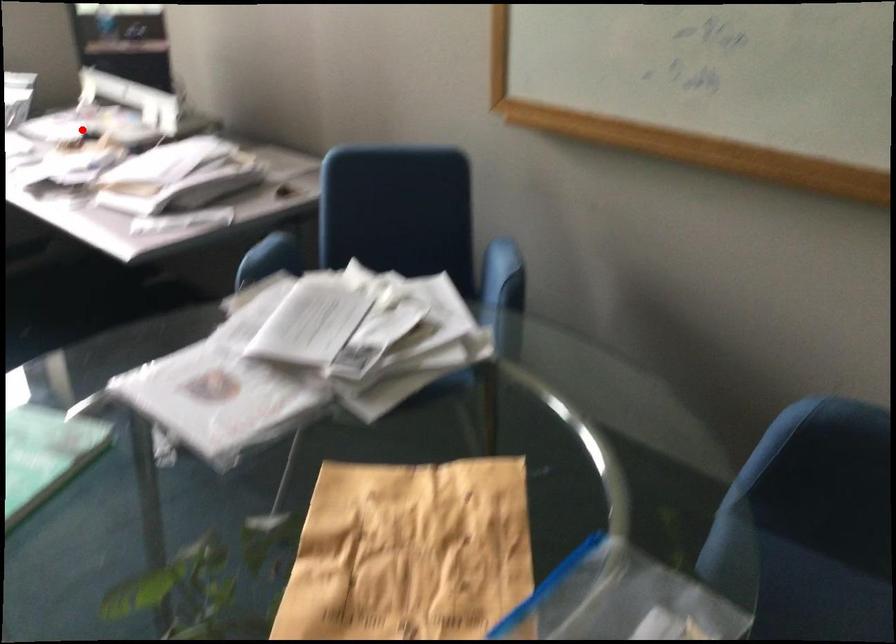
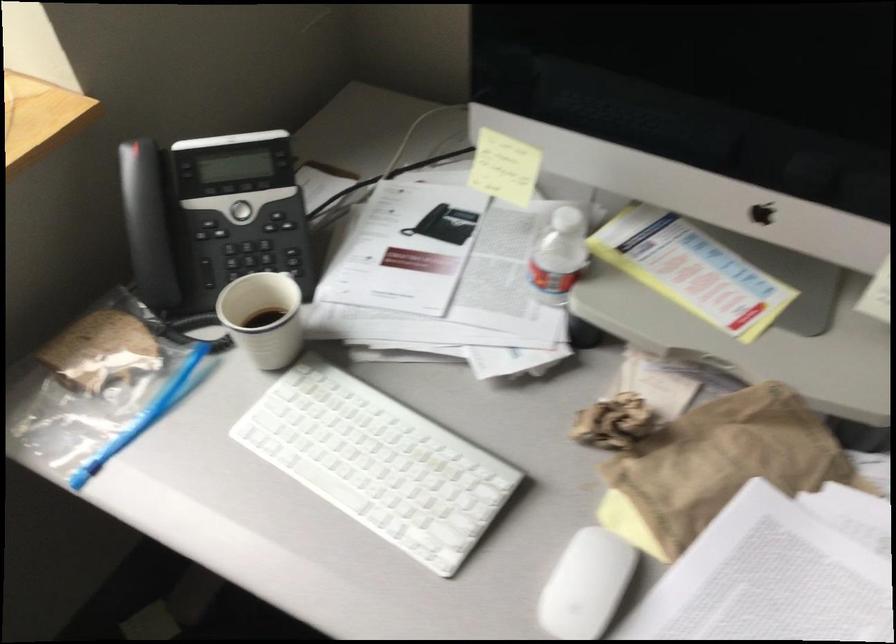
Question: I am providing you with two images of the same scene from different viewpoints. Given a red point in image1, look at the same physical point in image2. Is it:

Choices:
 (A) Closer to the viewpoint
 (B) Farther from the viewpoint

Answer: (A)